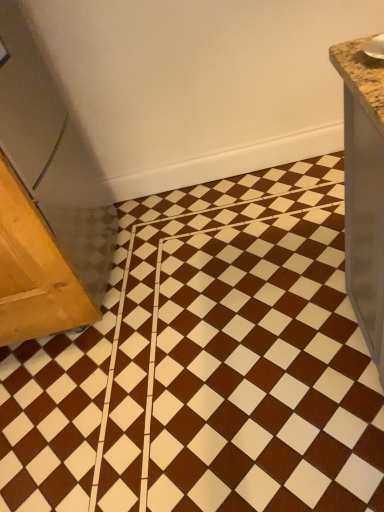
Question: From a real-world perspective, is brown glossy ceramic tile at center on wooden table at left?

Choices:
 (A) no
 (B) yes

Answer: (A)

Question: Is brown glossy ceramic tile at center behind wooden table at left?

Choices:
 (A) no
 (B) yes

Answer: (A)

Question: Is brown glossy ceramic tile at center smaller than wooden table at left?

Choices:
 (A) no
 (B) yes

Answer: (A)

Question: From a real-world perspective, does brown glossy ceramic tile at center sit lower than wooden table at left?

Choices:
 (A) yes
 (B) no

Answer: (A)

Question: Is brown glossy ceramic tile at center placed right next to wooden table at left?

Choices:
 (A) no
 (B) yes

Answer: (A)

Question: Is brown glossy ceramic tile at center to the right of wooden table at left from the viewer's perspective?

Choices:
 (A) no
 (B) yes

Answer: (B)

Question: Is wooden table at left beside brown glossy ceramic tile at center?

Choices:
 (A) yes
 (B) no

Answer: (B)

Question: Could you tell me if wooden table at left is facing brown glossy ceramic tile at center?

Choices:
 (A) no
 (B) yes

Answer: (A)

Question: Does wooden table at left contain brown glossy ceramic tile at center?

Choices:
 (A) yes
 (B) no

Answer: (B)

Question: Is wooden table at left turned away from brown glossy ceramic tile at center?

Choices:
 (A) yes
 (B) no

Answer: (B)

Question: Does wooden table at left come behind brown glossy ceramic tile at center?

Choices:
 (A) no
 (B) yes

Answer: (B)

Question: Is wooden table at left positioned far away from brown glossy ceramic tile at center?

Choices:
 (A) yes
 (B) no

Answer: (B)

Question: From the image's perspective, relative to brown glossy ceramic tile at center, is wooden table at left above or below?

Choices:
 (A) below
 (B) above

Answer: (A)